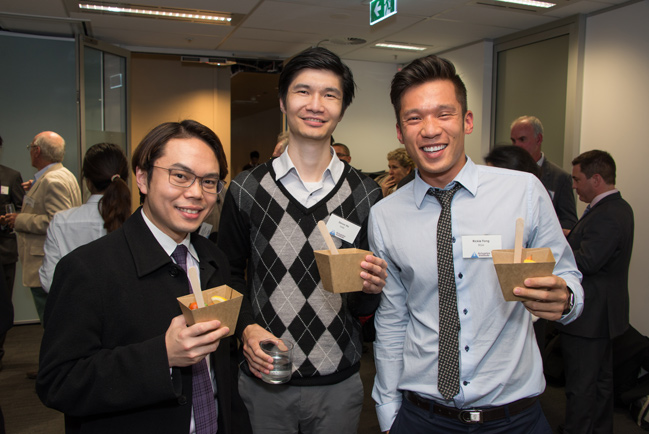
Identify the location of wall. (176, 103), (373, 109), (601, 96).